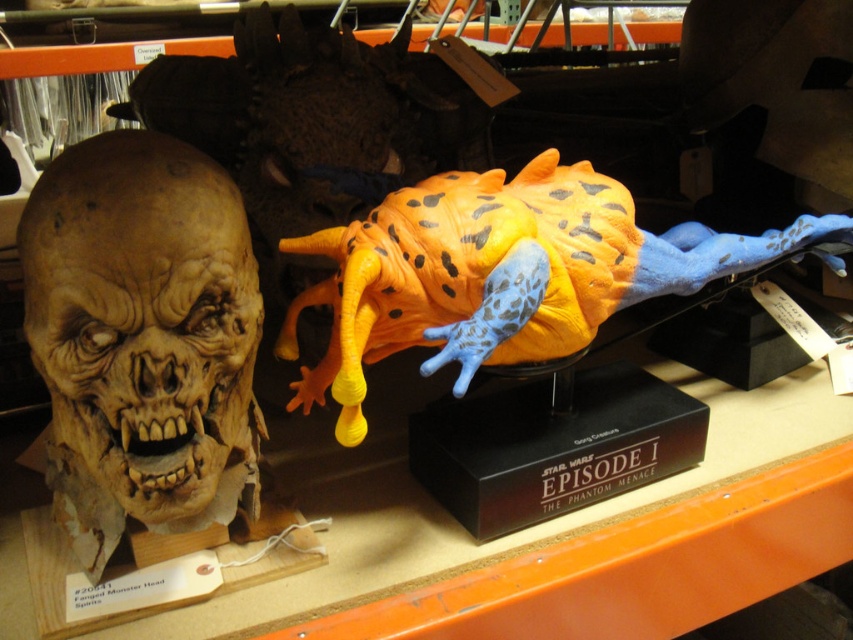
Does matte plastic skull at left appear on the right side of orange spotted rubber toy at center?

In fact, matte plastic skull at left is to the left of orange spotted rubber toy at center.

Is matte plastic skull at left shorter than orange spotted rubber toy at center?

Incorrect, matte plastic skull at left's height does not fall short of orange spotted rubber toy at center's.

Between point (155, 420) and point (525, 269), which one is positioned behind?

The point (525, 269) is behind.

This screenshot has width=853, height=640. I want to click on matte plastic skull at left, so [x=144, y=317].